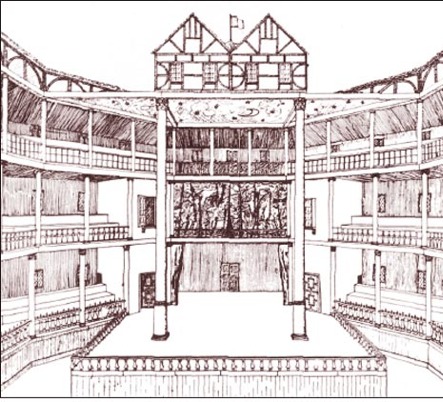
I want to click on support beam, so click(x=200, y=94).